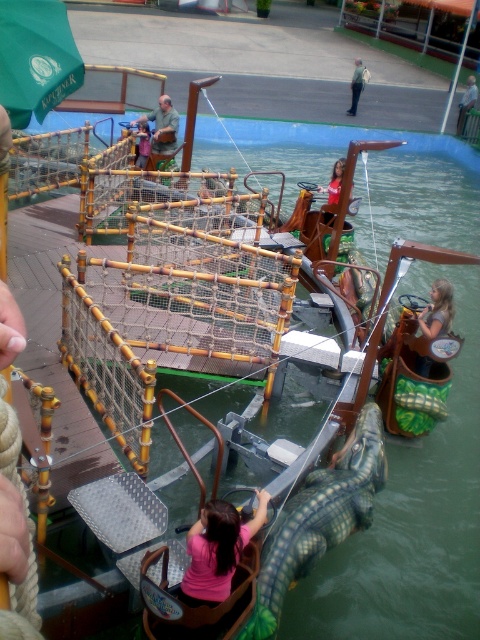
You are a park visitor who wants to take a photo of both the brown leather jacket at upper center and the pink fabric shirt at center. Can you capture both in a single shot without moving your camera position?

Yes, the brown leather jacket at upper center is above the pink fabric shirt at center, so both can be captured in a single photo without moving the camera position.

You are a park engineer checking the safety of the water ride. The ride boat must stay within a 1 meter radius of the center point of the ride area to avoid collision with obstacles. The center point of the ride area is at point coordinates of 0.5, 0.5. Can the boat safely navigate near the light brown wooden pole at upper right without colliding?

The light brown wooden pole at upper right is located at point coordinates of (467, 102). The distance between the pole and the center point at (240, 320) is calculated using the distance formula. The distance is sqrt of squared differences in x and y coordinates. The calculation gives sqrt of 0.339 squared plus 0.427 squared, which equals sqrt of 0.115 and 0.182, totaling sqrt of 0.297. The square root of 0.297 is approximately 0.545 meters. Since 0.545 meters is less than 1 meter, the boat can safely stay

You are standing in front of the water ride boat. There are two points marked on the boat. The first point is at coordinate point (320,189) and the second point is at coordinate point (146,129). Which point is closer to you?

Point (320,189) is closer to the viewer than point (146,129).